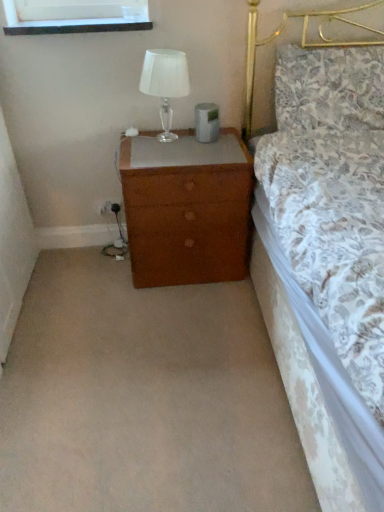
Question: Considering the relative sizes of brown wood nightstand at lower center and clear glass table lamp at upper right in the image provided, is brown wood nightstand at lower center smaller than clear glass table lamp at upper right?

Choices:
 (A) yes
 (B) no

Answer: (B)

Question: Is brown wood nightstand at lower center bigger than clear glass table lamp at upper right?

Choices:
 (A) yes
 (B) no

Answer: (A)

Question: Can you confirm if brown wood nightstand at lower center is positioned to the left of clear glass table lamp at upper right?

Choices:
 (A) yes
 (B) no

Answer: (B)

Question: Is clear glass table lamp at upper right surrounded by brown wood nightstand at lower center?

Choices:
 (A) no
 (B) yes

Answer: (A)

Question: From a real-world perspective, is brown wood nightstand at lower center located beneath clear glass table lamp at upper right?

Choices:
 (A) yes
 (B) no

Answer: (A)

Question: Considering their positions, is floral fabric pillow at upper right located in front of or behind clear glass table lamp at upper right?

Choices:
 (A) behind
 (B) front

Answer: (A)

Question: Considering the positions of floral fabric pillow at upper right and clear glass table lamp at upper right in the image, is floral fabric pillow at upper right wider or thinner than clear glass table lamp at upper right?

Choices:
 (A) thin
 (B) wide

Answer: (B)

Question: Is floral fabric pillow at upper right to the left or to the right of clear glass table lamp at upper right in the image?

Choices:
 (A) left
 (B) right

Answer: (B)

Question: Considering the positions of floral fabric pillow at upper right and clear glass table lamp at upper right in the image, is floral fabric pillow at upper right bigger or smaller than clear glass table lamp at upper right?

Choices:
 (A) small
 (B) big

Answer: (B)

Question: Does point (165, 123) appear closer or farther from the camera than point (339, 75)?

Choices:
 (A) closer
 (B) farther

Answer: (B)

Question: From a real-world perspective, relative to floral fabric pillow at upper right, is clear glass table lamp at upper right vertically above or below?

Choices:
 (A) below
 (B) above

Answer: (A)

Question: Relative to floral fabric pillow at upper right, is clear glass table lamp at upper right in front or behind?

Choices:
 (A) front
 (B) behind

Answer: (A)

Question: Visually, is clear glass table lamp at upper right positioned to the left or to the right of floral fabric pillow at upper right?

Choices:
 (A) left
 (B) right

Answer: (A)

Question: From a real-world perspective, is floral fabric pillow at upper right positioned above or below brown wood nightstand at lower center?

Choices:
 (A) above
 (B) below

Answer: (A)

Question: Is floral fabric pillow at upper right in front of or behind brown wood nightstand at lower center in the image?

Choices:
 (A) behind
 (B) front

Answer: (A)